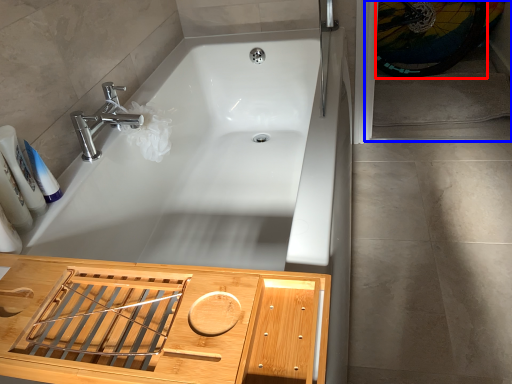
Question: Which of the following is the farthest to the observer, bicycle wheel (highlighted by a red box) or screen door (highlighted by a blue box)?

Choices:
 (A) bicycle wheel
 (B) screen door

Answer: (A)